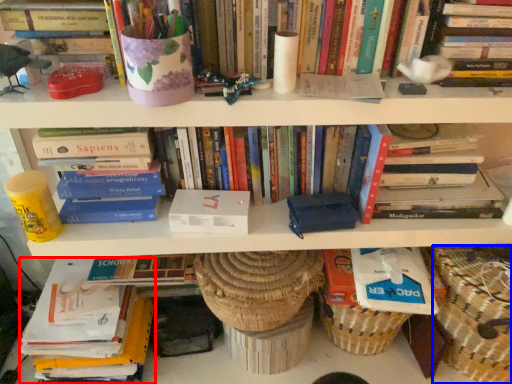
Question: Among these objects, which one is farthest to the camera, book (highlighted by a red box) or basket (highlighted by a blue box)?

Choices:
 (A) book
 (B) basket

Answer: (A)